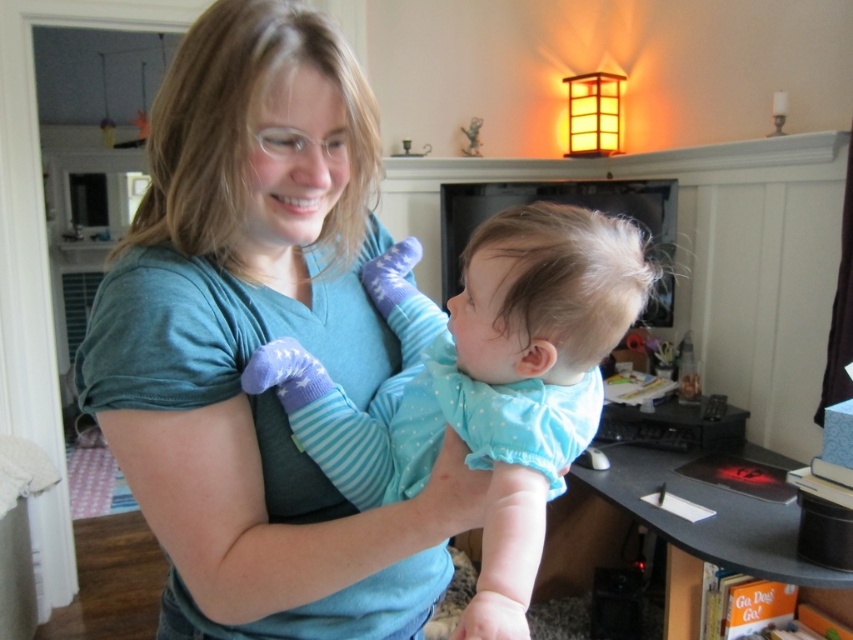
Is point (263, 579) positioned before point (540, 452)?

No, it is not.

Does matte teal shirt at center have a greater width compared to light blue fabric baby at center?

Incorrect, matte teal shirt at center's width does not surpass light blue fabric baby at center's.

What are the coordinates of `matte teal shirt at center` in the screenshot? It's located at (258, 342).